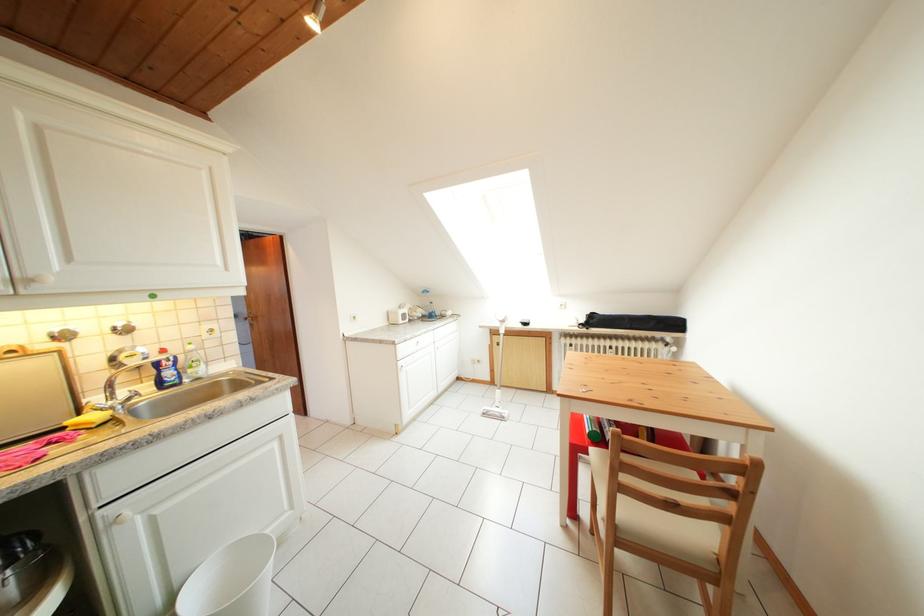
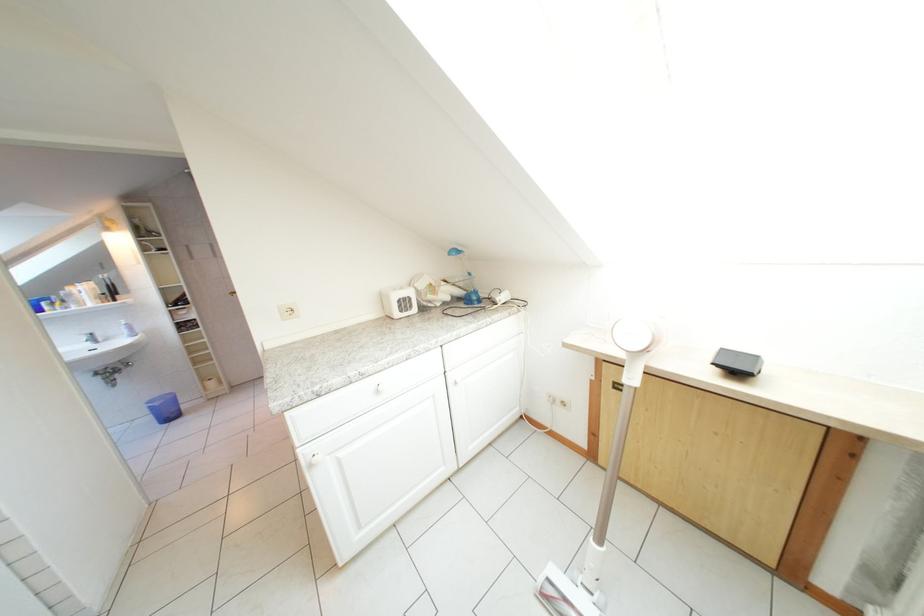
Question: The images are taken continuously from a first-person perspective. In which direction are you moving?

Choices:
 (A) Left
 (B) Right
 (C) Forward
 (D) Backward

Answer: (C)